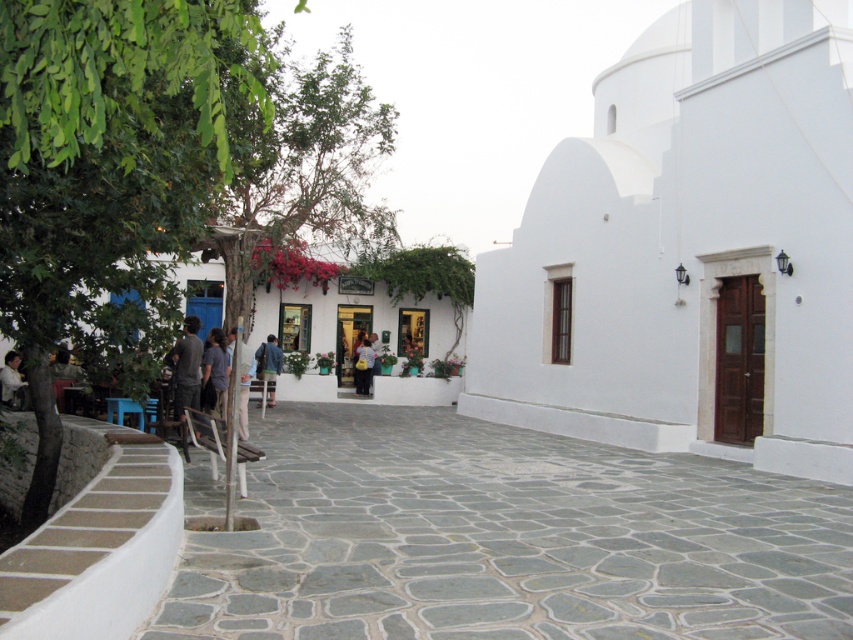
From the picture: Does white smooth church at center have a smaller size compared to gray stone alley at center?

Actually, white smooth church at center might be larger than gray stone alley at center.

Can you confirm if white smooth church at center is bigger than gray stone alley at center?

Yes.

Who is more distant from viewer, [785,250] or [404,445]?

The point [404,445] is more distant.

Identify the location of white smooth church at center. The width and height of the screenshot is (853, 640). (688, 248).

Is point (404, 605) closer to viewer compared to point (227, 364)?

Yes, point (404, 605) is closer to viewer.

Is gray stone alley at center bigger than dark gray fabric jacket at center?

Yes.

Image resolution: width=853 pixels, height=640 pixels. Identify the location of gray stone alley at center. (508, 538).

Is gray stone alley at center smaller than blue denim jeans at center?

Indeed, gray stone alley at center has a smaller size compared to blue denim jeans at center.

Who is more distant from viewer, [811,483] or [242,371]?

The point [242,371] is more distant.

Find the location of a particular element. gray stone alley at center is located at coordinates (508, 538).